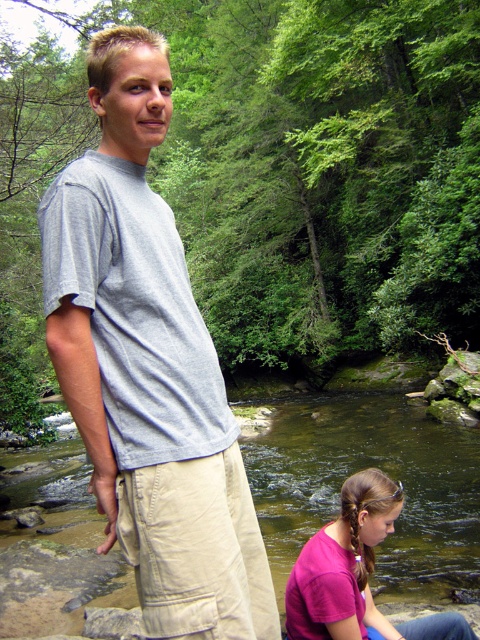
Is green smooth water at lower center closer to camera compared to khaki cotton shorts at lower center?

No, green smooth water at lower center is further to the viewer.

At what (x,y) coordinates should I click in order to perform the action: click on green smooth water at lower center. Please return your answer as a coordinate pair (x, y). This screenshot has height=640, width=480. Looking at the image, I should click on (361, 468).

From the picture: Is gray cotton t-shirt at center further to the viewer compared to green smooth water at lower center?

No, it is in front of green smooth water at lower center.

Does gray cotton t-shirt at center have a greater height compared to green smooth water at lower center?

No, gray cotton t-shirt at center is not taller than green smooth water at lower center.

At what (x,y) coordinates should I click in order to perform the action: click on gray cotton t-shirt at center. Please return your answer as a coordinate pair (x, y). This screenshot has height=640, width=480. Looking at the image, I should click on 148,365.

This screenshot has width=480, height=640. What are the coordinates of `gray cotton t-shirt at center` in the screenshot? It's located at (148, 365).

Who is more distant from viewer, (187, 509) or (324, 540)?

The point (324, 540) is behind.

Which of these two, khaki cotton shorts at lower center or pink matte shirt at lower center, stands taller?

pink matte shirt at lower center

Who is more distant from viewer, [128,490] or [375,509]?

The point [375,509] is more distant.

Where is `khaki cotton shorts at lower center`? The width and height of the screenshot is (480, 640). khaki cotton shorts at lower center is located at coordinates (196, 548).